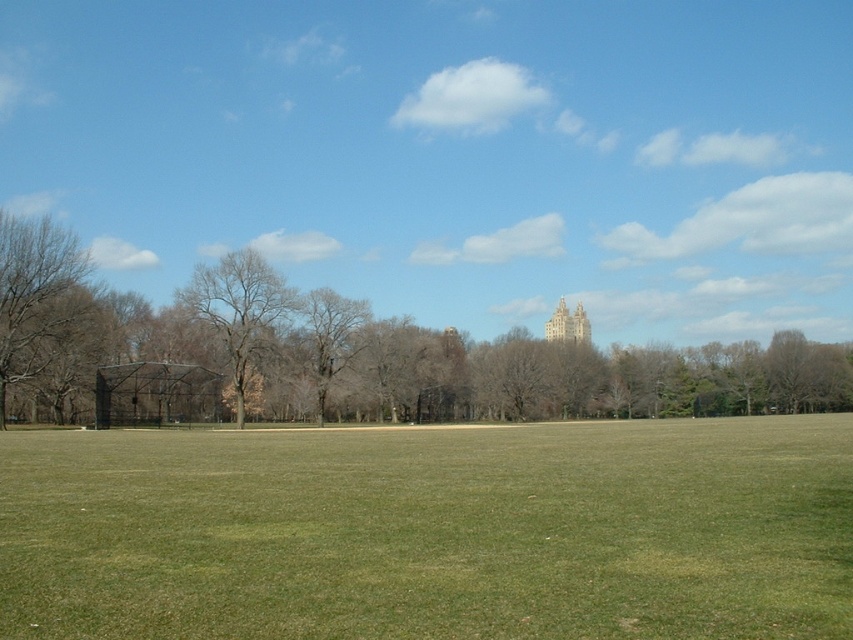
Question: Is green grassy field at center positioned behind brown leafy tree at center?

Choices:
 (A) no
 (B) yes

Answer: (A)

Question: Which point is farther to the camera?

Choices:
 (A) (561, 320)
 (B) (837, 369)
 (C) (250, 316)

Answer: (A)

Question: Can you confirm if green grassy field at center is smaller than brown leafy tree at center?

Choices:
 (A) no
 (B) yes

Answer: (A)

Question: Which point is closer to the camera?

Choices:
 (A) bare branches at center
 (B) brown leafy tree at center
 (C) light brown stone tower at center
 (D) brown leafless tree at left

Answer: (D)

Question: Based on their relative distances, which object is nearer to the brown leafless tree at left?

Choices:
 (A) green grassy field at center
 (B) light brown stone tower at center

Answer: (B)

Question: Can you confirm if brown leafy tree at center is positioned to the left of light brown stone tower at center?

Choices:
 (A) yes
 (B) no

Answer: (A)